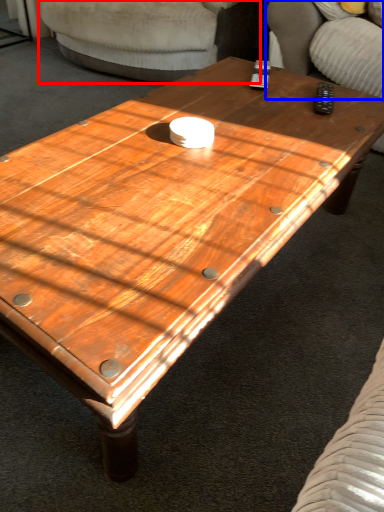
Question: Which of the following is the closest to the observer, armchair (highlighted by a red box) or armchair (highlighted by a blue box)?

Choices:
 (A) armchair
 (B) armchair

Answer: (B)